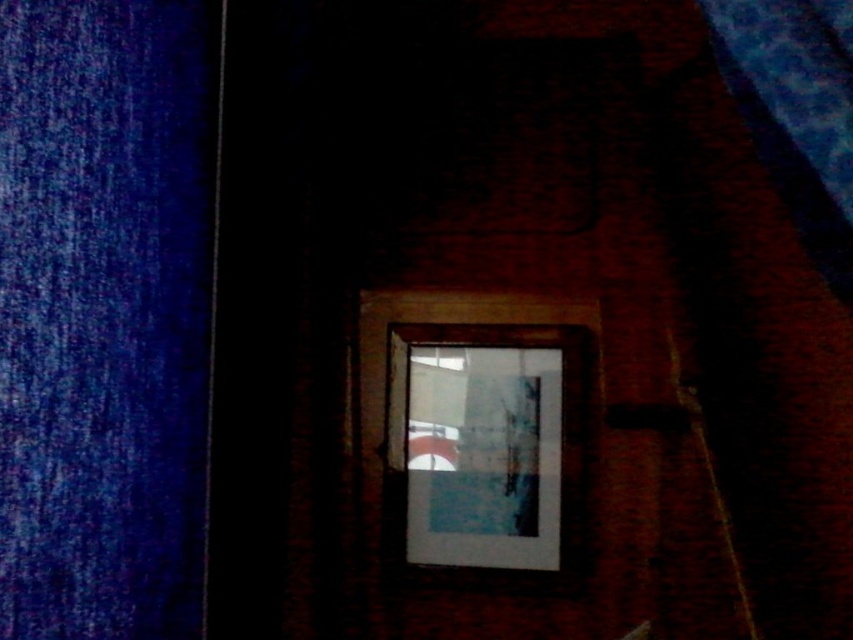
Does blue fabric curtain at left appear on the right side of wooden picture frame at center?

No, blue fabric curtain at left is not to the right of wooden picture frame at center.

Consider the image. Is blue fabric curtain at left thinner than wooden picture frame at center?

Yes.

Who is more distant from viewer, (155, 584) or (404, 520)?

The point (404, 520) is more distant.

Locate an element on the screen. The image size is (853, 640). blue fabric curtain at left is located at coordinates (103, 314).

Does blue fabric curtain at left have a greater height compared to blue fabric curtain at upper right?

Indeed, blue fabric curtain at left has a greater height compared to blue fabric curtain at upper right.

Between point (138, 256) and point (791, 211), which one is positioned in front?

Point (138, 256) is in front.

Where is `blue fabric curtain at left`? Image resolution: width=853 pixels, height=640 pixels. blue fabric curtain at left is located at coordinates (103, 314).

Who is positioned more to the right, wooden picture frame at center or blue fabric curtain at upper right?

blue fabric curtain at upper right is more to the right.

Which is below, wooden picture frame at center or blue fabric curtain at upper right?

wooden picture frame at center

The width and height of the screenshot is (853, 640). Describe the element at coordinates (490, 444) in the screenshot. I see `wooden picture frame at center` at that location.

Identify the location of wooden picture frame at center. This screenshot has height=640, width=853. (490, 444).